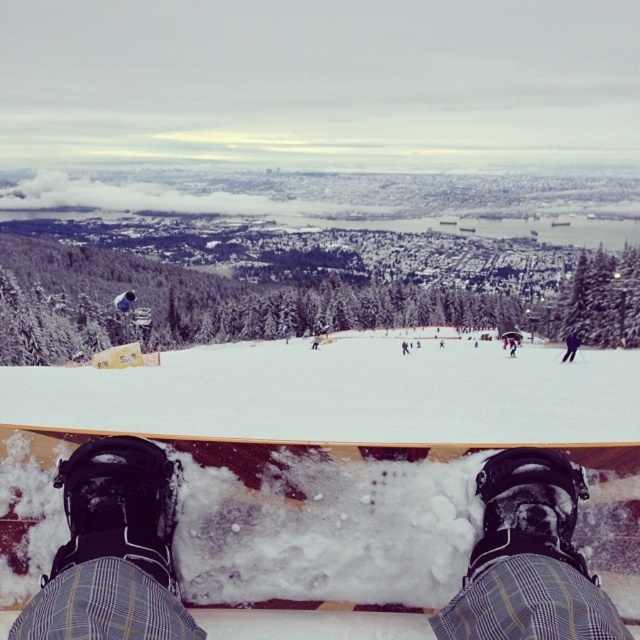
Is white snowboard at center shorter than black matte snowboarder at center?

Incorrect, white snowboard at center's height does not fall short of black matte snowboarder at center's.

Does white snowboard at center have a lesser width compared to black matte snowboarder at center?

Incorrect, white snowboard at center's width is not less than black matte snowboarder at center's.

Does point (404, 371) lie behind point (579, 340)?

No, it is in front of (579, 340).

Image resolution: width=640 pixels, height=640 pixels. I want to click on white snowboard at center, so click(x=340, y=394).

Does white snowboard at center have a larger size compared to black matte snowboard boots at lower center?

Indeed, white snowboard at center has a larger size compared to black matte snowboard boots at lower center.

Does white snowboard at center appear over black matte snowboard boots at lower center?

No.

Does point (141, 387) come closer to viewer compared to point (147, 612)?

No.

Where is `white snowboard at center`? This screenshot has height=640, width=640. white snowboard at center is located at coordinates (340, 394).

Between black matte snowboard boots at lower center and black matte snowboarder at center, which one has more height?

black matte snowboarder at center is taller.

Which is in front, point (490, 634) or point (572, 352)?

Positioned in front is point (490, 634).

At what (x,y) coordinates should I click in order to perform the action: click on black matte snowboard boots at lower center. Please return your answer as a coordinate pair (x, y). The height and width of the screenshot is (640, 640). Looking at the image, I should click on (113, 550).